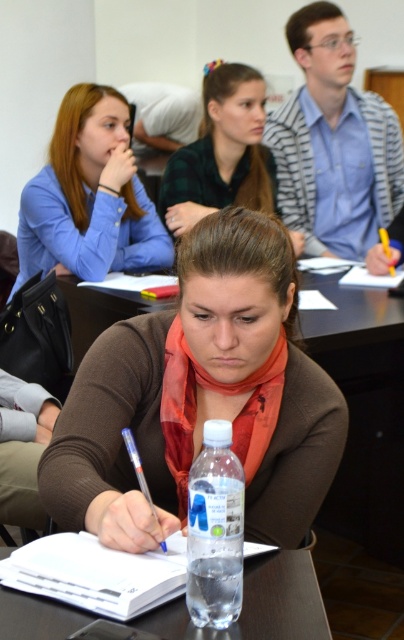
Between point (267, 333) and point (231, 538), which one is positioned in front?

Point (231, 538) is in front.

Does point (202, 323) come behind point (223, 477)?

Yes, point (202, 323) is behind point (223, 477).

Is point (237, 360) behind point (237, 468)?

Yes, point (237, 360) is farther from viewer.

At what (x,y) coordinates should I click in order to perform the action: click on brown matte scarf at center. Please return your answer as a coordinate pair (x, y). The height and width of the screenshot is (640, 404). Looking at the image, I should click on (201, 397).

Can you confirm if matte blue shirt at upper left is smaller than clear plastic bottle at center?

Actually, matte blue shirt at upper left might be larger than clear plastic bottle at center.

Can you confirm if matte blue shirt at upper left is shorter than clear plastic bottle at center?

In fact, matte blue shirt at upper left may be taller than clear plastic bottle at center.

Describe the element at coordinates (88, 196) in the screenshot. This screenshot has width=404, height=640. I see `matte blue shirt at upper left` at that location.

Find the location of a particular element. matte blue shirt at upper left is located at coordinates (88, 196).

How much distance is there between matte blue shirt at upper left and green plaid shirt at upper center?

matte blue shirt at upper left and green plaid shirt at upper center are 38.44 centimeters apart.

The height and width of the screenshot is (640, 404). I want to click on matte blue shirt at upper left, so click(x=88, y=196).

Locate an element on the screen. This screenshot has width=404, height=640. matte blue shirt at upper left is located at coordinates [x=88, y=196].